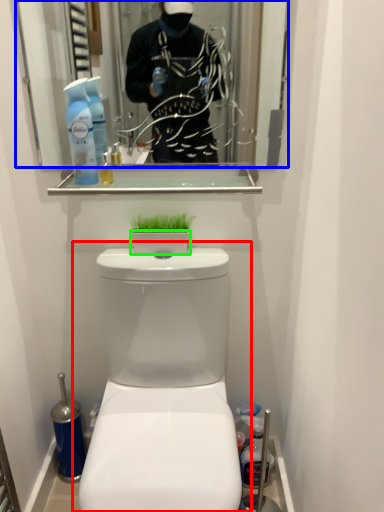
Question: Estimate the real-world distances between objects in this image. Which object is farther from toilet (highlighted by a red box), mirror (highlighted by a blue box) or toilet bowl (highlighted by a green box)?

Choices:
 (A) mirror
 (B) toilet bowl

Answer: (A)